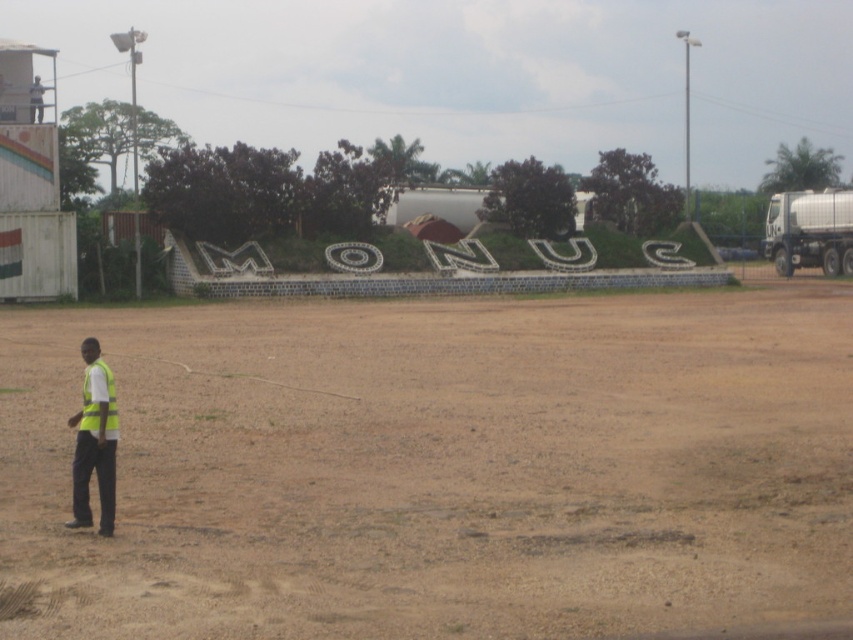
You are a construction worker needing to walk from the yellow reflective safety vest at lower left to the brown sandy dirt field at center. Based on the scene description, is the path directly between these two objects elevated or lower?

The brown sandy dirt field at center is located below the yellow reflective safety vest at lower left, so the path would be going downhill towards the brown sandy dirt field at center.

You are a surveyor standing on the brown sandy dirt field at center and need to place a marker on the yellow reflective safety vest at lower left. Considering the height difference between them, will you have to climb upwards or downwards to reach the vest?

The brown sandy dirt field at center has a greater height compared to yellow reflective safety vest at lower left, so you will have to go downwards to reach the vest.